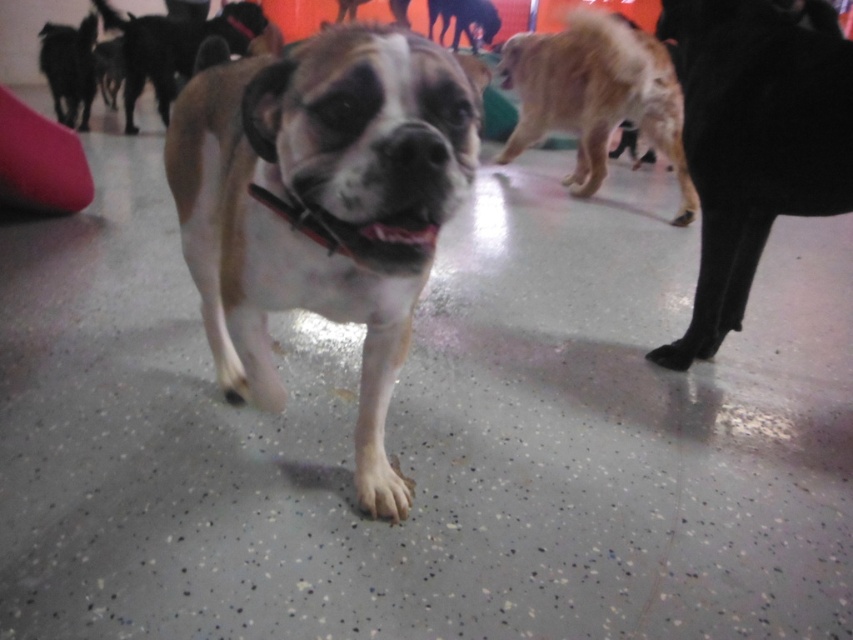
Is brown matte dog at upper left to the right of black fur dog at upper left from the viewer's perspective?

Indeed, brown matte dog at upper left is positioned on the right side of black fur dog at upper left.

In the scene shown: Is brown matte dog at upper left above black fur dog at upper left?

Yes, brown matte dog at upper left is above black fur dog at upper left.

Which is behind, point (233, 44) or point (51, 86)?

The point (51, 86) is behind.

You are a GUI agent. You are given a task and a screenshot of the screen. Output one action in this format:
    pyautogui.click(x=<x>, y=<y>)
    Task: Click on the brown matte dog at upper left
    The width and height of the screenshot is (853, 640).
    Given the screenshot: What is the action you would take?
    pyautogui.click(x=173, y=48)

Does golden fur dog at upper right appear under black fur dog at upper left?

Yes, golden fur dog at upper right is below black fur dog at upper left.

I want to click on golden fur dog at upper right, so click(595, 96).

Describe the element at coordinates (595, 96) in the screenshot. This screenshot has height=640, width=853. I see `golden fur dog at upper right` at that location.

In order to click on golden fur dog at upper right in this screenshot , I will do `click(595, 96)`.

Does white fur dog at center have a lesser height compared to brown matte dog at upper left?

Correct, white fur dog at center is not as tall as brown matte dog at upper left.

Is white fur dog at center bigger than brown matte dog at upper left?

No, white fur dog at center is not bigger than brown matte dog at upper left.

Who is more forward, (257,296) or (125,28)?

Point (257,296) is more forward.

At what (x,y) coordinates should I click in order to perform the action: click on white fur dog at center. Please return your answer as a coordinate pair (x, y). The image size is (853, 640). Looking at the image, I should click on (321, 205).